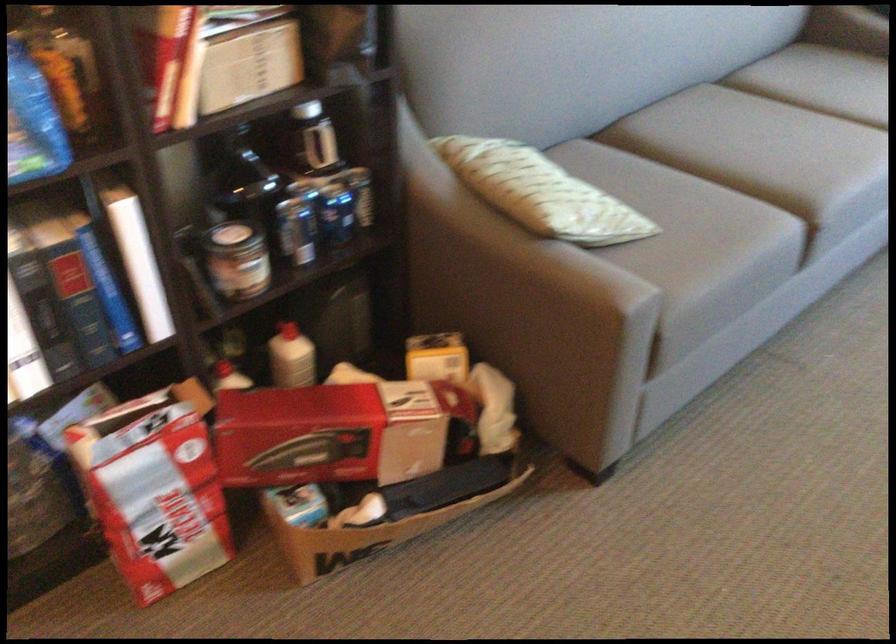
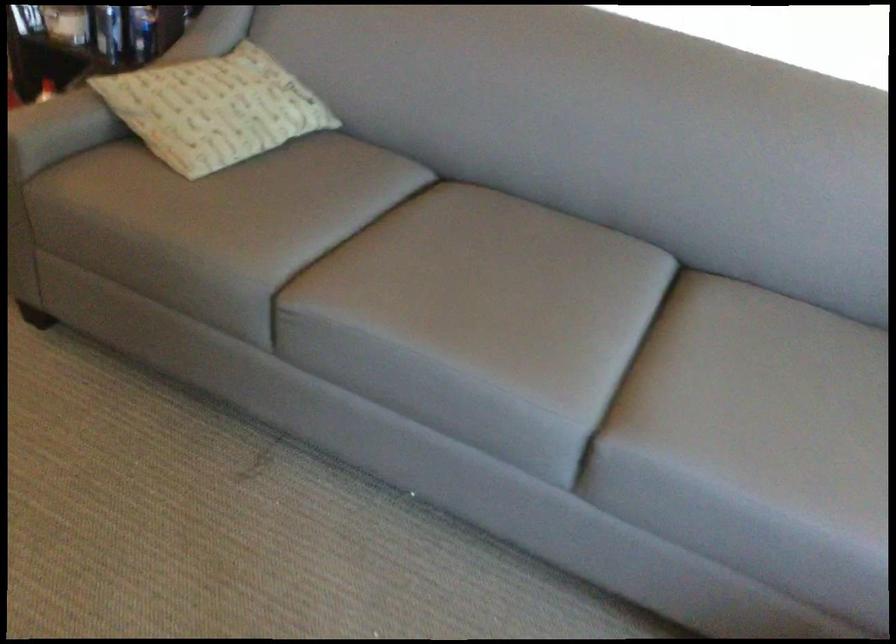
Find the pixel in the second image that matches point (593, 287) in the first image.

(32, 125)